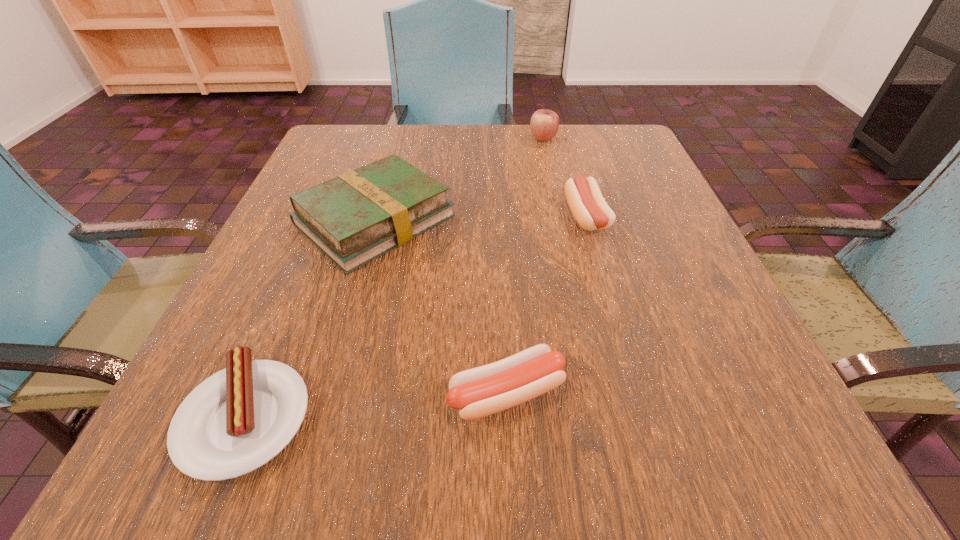
Identify the location of blank space located on the back of the second sausage from left to right. The image size is (960, 540). (503, 310).

This screenshot has height=540, width=960. What are the coordinates of `vacant space located 0.090m on the right of the shortest object` in the screenshot? It's located at (383, 416).

I want to click on object at the far edge, so click(544, 124).

The width and height of the screenshot is (960, 540). What are the coordinates of `book that is positioned at the left edge` in the screenshot? It's located at (358, 216).

Image resolution: width=960 pixels, height=540 pixels. Identify the location of sausage located in the left edge section of the desktop. (237, 420).

Image resolution: width=960 pixels, height=540 pixels. I want to click on object that is at the right edge, so point(589,208).

The image size is (960, 540). In order to click on object that is at the near left corner in this screenshot , I will do `click(237, 420)`.

In order to click on free space at the far edge in this screenshot , I will do tap(428, 126).

At what (x,y) coordinates should I click in order to perform the action: click on free space at the near edge. Please return your answer as a coordinate pair (x, y). Image resolution: width=960 pixels, height=540 pixels. Looking at the image, I should click on (630, 414).

Where is `vacant space at the left edge of the desktop`? The image size is (960, 540). vacant space at the left edge of the desktop is located at coordinates (289, 347).